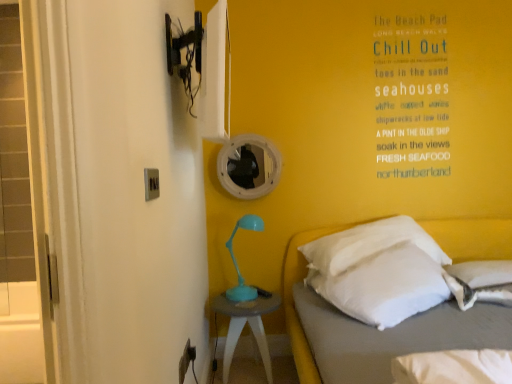
Question: Is white soft pillow at right, which ranks as the second pillow in right-to-left order, taller than white soft bed at lower right?

Choices:
 (A) yes
 (B) no

Answer: (B)

Question: Considering the relative sizes of white soft pillow at right, arranged as the first pillow when viewed from the left, and white soft bed at lower right in the image provided, is white soft pillow at right, arranged as the first pillow when viewed from the left, wider than white soft bed at lower right?

Choices:
 (A) no
 (B) yes

Answer: (A)

Question: Is white soft bed at lower right a part of white soft pillow at right, arranged as the first pillow when viewed from the left?

Choices:
 (A) no
 (B) yes

Answer: (A)

Question: Is white soft pillow at right, arranged as the first pillow when viewed from the left, positioned far away from white soft bed at lower right?

Choices:
 (A) yes
 (B) no

Answer: (B)

Question: Could you tell me if white soft pillow at right, which ranks as the second pillow in right-to-left order, is facing white soft bed at lower right?

Choices:
 (A) no
 (B) yes

Answer: (B)

Question: Is point (229, 289) positioned closer to the camera than point (186, 364)?

Choices:
 (A) farther
 (B) closer

Answer: (A)

Question: Is teal plastic table lamp at center in front of or behind matte gray electric outlet at lower center, the first electric outlet positioned from the back, in the image?

Choices:
 (A) front
 (B) behind

Answer: (B)

Question: Is teal plastic table lamp at center to the left or to the right of matte gray electric outlet at lower center, the 2th electric outlet from the top, in the image?

Choices:
 (A) left
 (B) right

Answer: (B)

Question: Looking at their shapes, would you say teal plastic table lamp at center is wider or thinner than matte gray electric outlet at lower center, the 2th electric outlet from the top?

Choices:
 (A) wide
 (B) thin

Answer: (A)

Question: Is white soft pillow at right, which ranks as the second pillow in right-to-left order, to the left or to the right of matte gray electric outlet at lower center, positioned as the 2th electric outlet in front-to-back order, in the image?

Choices:
 (A) left
 (B) right

Answer: (B)

Question: From the image's perspective, relative to matte gray electric outlet at lower center, positioned as the 2th electric outlet in front-to-back order, is white soft pillow at right, which ranks as the second pillow in right-to-left order, above or below?

Choices:
 (A) below
 (B) above

Answer: (B)

Question: Relative to matte gray electric outlet at lower center, positioned as the 2th electric outlet in front-to-back order, is white soft pillow at right, arranged as the first pillow when viewed from the left, in front or behind?

Choices:
 (A) front
 (B) behind

Answer: (B)

Question: Do you think white soft pillow at right, arranged as the first pillow when viewed from the left, is within matte gray electric outlet at lower center, the first electric outlet when ordered from bottom to top, or outside of it?

Choices:
 (A) inside
 (B) outside

Answer: (B)

Question: Looking at the image, does white soft pillow at lower right, which ranks as the second pillow in left-to-right order, seem bigger or smaller compared to matte silver switch at upper left, the 2th electric outlet from the back?

Choices:
 (A) big
 (B) small

Answer: (A)

Question: Is white soft pillow at lower right, which ranks as the second pillow in left-to-right order, wider or thinner than matte silver switch at upper left, acting as the first electric outlet starting from the top?

Choices:
 (A) thin
 (B) wide

Answer: (B)